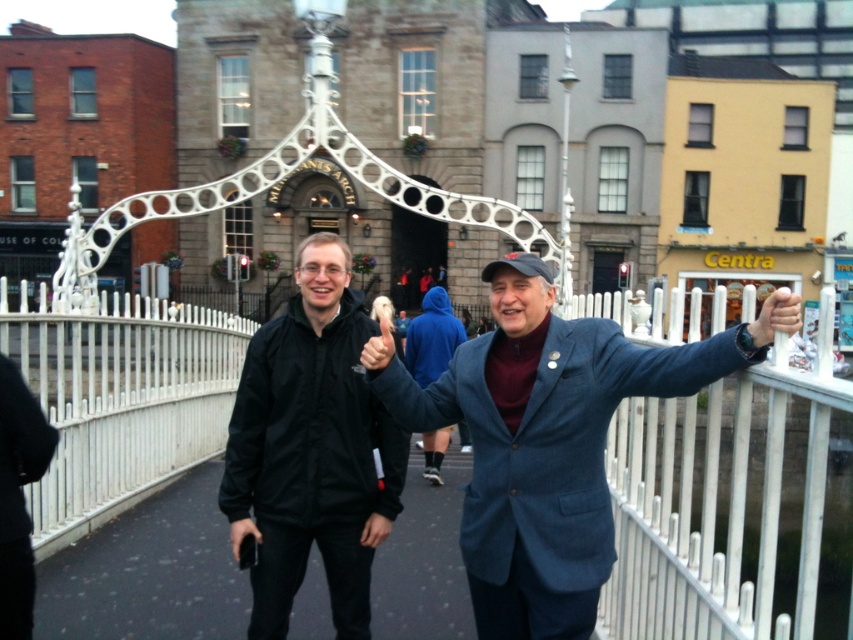
Can you confirm if white metal railing at right is shorter than black matte jacket at center?

In fact, white metal railing at right may be taller than black matte jacket at center.

Which is in front, point (657, 628) or point (235, 515)?

Point (657, 628) is more forward.

Image resolution: width=853 pixels, height=640 pixels. I want to click on white metal railing at right, so click(730, 508).

At what (x,y) coordinates should I click in order to perform the action: click on denim jacket at center. Please return your answer as a coordinate pair (x, y). The height and width of the screenshot is (640, 853). Looking at the image, I should click on (x=541, y=444).

Measure the distance between denim jacket at center and white metal bridge at center.

They are 25.60 meters apart.

Between point (515, 538) and point (68, 253), which one is positioned in front?

Positioned in front is point (515, 538).

Locate an element on the screen. This screenshot has height=640, width=853. denim jacket at center is located at coordinates (541, 444).

Can you confirm if white metal railing at right is taller than white metal fence at center?

Correct, white metal railing at right is much taller as white metal fence at center.

Who is more forward, (650, 534) or (53, 372)?

Point (650, 534)

Where is `white metal railing at right`? The width and height of the screenshot is (853, 640). white metal railing at right is located at coordinates (730, 508).